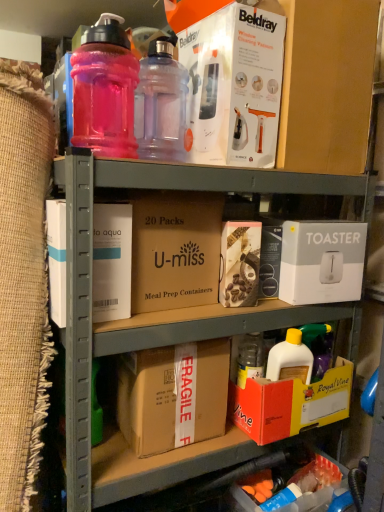
Question: From the image's perspective, is brown cardboard box at center, acting as the second cardboard box starting from the top, positioned above or below brown cardboard at center, placed as the 1th cardboard box when sorted from top to bottom?

Choices:
 (A) above
 (B) below

Answer: (B)

Question: Is brown cardboard box at center, acting as the second cardboard box starting from the top, taller or shorter than brown cardboard at center, placed as the 1th cardboard box when sorted from top to bottom?

Choices:
 (A) tall
 (B) short

Answer: (B)

Question: Which object is the closest to the white cardboard box at upper center, which appears as the fifth box when ordered from the bottom?

Choices:
 (A) orange cardboard box at lower right, which is counted as the second box, starting from the bottom
 (B) translucent pink plastic bottle at upper left, which appears as the 1th bottle when viewed from the left
 (C) brown cardboard box at center, which is counted as the 1th cardboard box, starting from the bottom
 (D) transparent plastic bottle at upper center, which is the 2th bottle in left-to-right order
 (E) pink matte box at center, the 2th box in the top-to-bottom sequence

Answer: (D)

Question: Which of these objects is positioned farthest from the white cardboard box at upper center, the first box from the top?

Choices:
 (A) pink matte box at center, which is the 4th box from bottom to top
 (B) transparent plastic bottle at upper center, which is the 2th bottle in left-to-right order
 (C) brown cardboard at center, the 2th cardboard box ordered from the bottom
 (D) brown cardboard box at center, acting as the second cardboard box starting from the top
 (E) white cardboard toaster at right, which ranks as the third box in top-to-bottom order

Answer: (D)